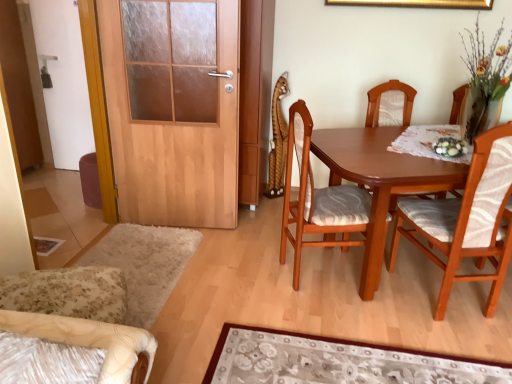
What are the coordinates of `free space in front of white glossy door at left` in the screenshot? It's located at (71, 178).